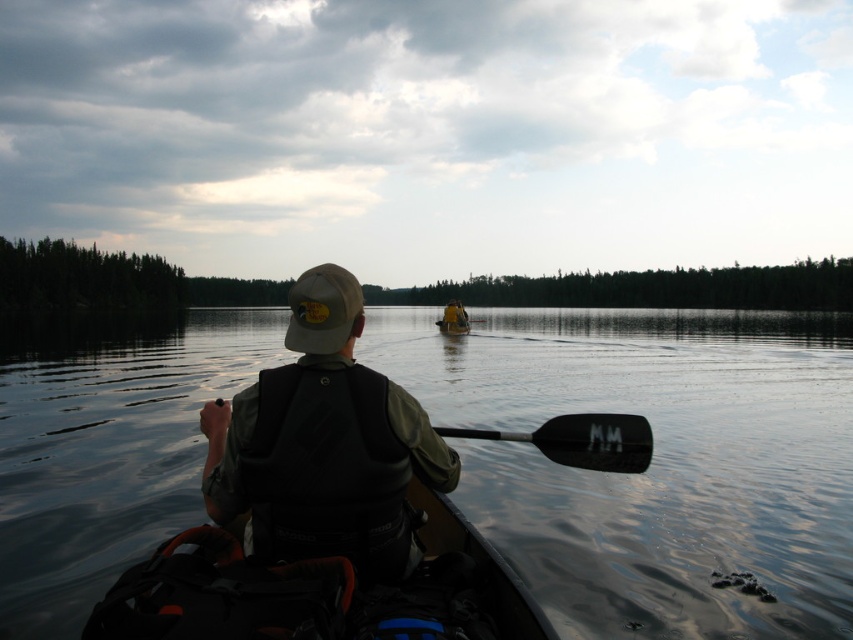
You are standing on a dock and see the matte black life vest at center in the water. If you want to grab it, will you need to swim or can you reach it from the dock?

Answer: The matte black life vest at center is 3.05 meters away from viewer. Since 3.05 meters is approximately 10 feet, you would need to swim to reach it from the dock.

You are a photographer trying to capture both the matte black kayak at center and the yellow fabric boat at center in a single shot. Based on their positions, which one should you focus on first to ensure both are in frame?

The matte black kayak at center is located below the yellow fabric boat at center, so you should focus on the yellow fabric boat at center first to ensure both are in frame.